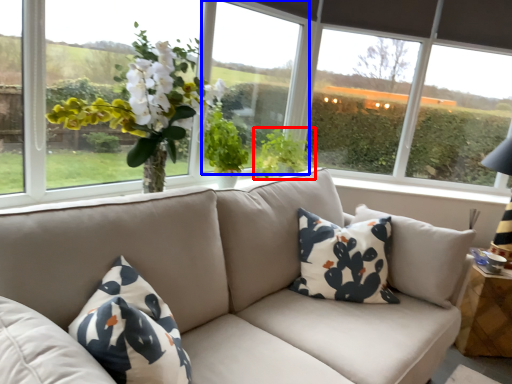
Question: Among these objects, which one is farthest to the camera, plant (highlighted by a red box) or window screen (highlighted by a blue box)?

Choices:
 (A) plant
 (B) window screen

Answer: (A)